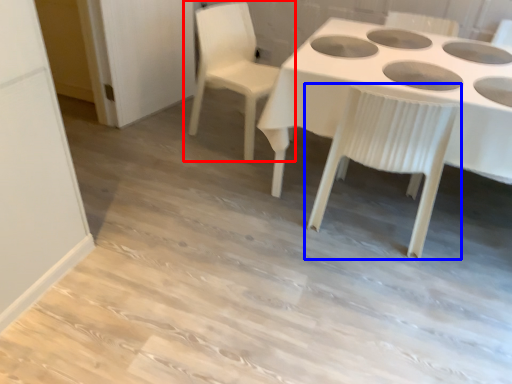
Question: Which of the following is the farthest to the observer, chair (highlighted by a red box) or chair (highlighted by a blue box)?

Choices:
 (A) chair
 (B) chair

Answer: (A)